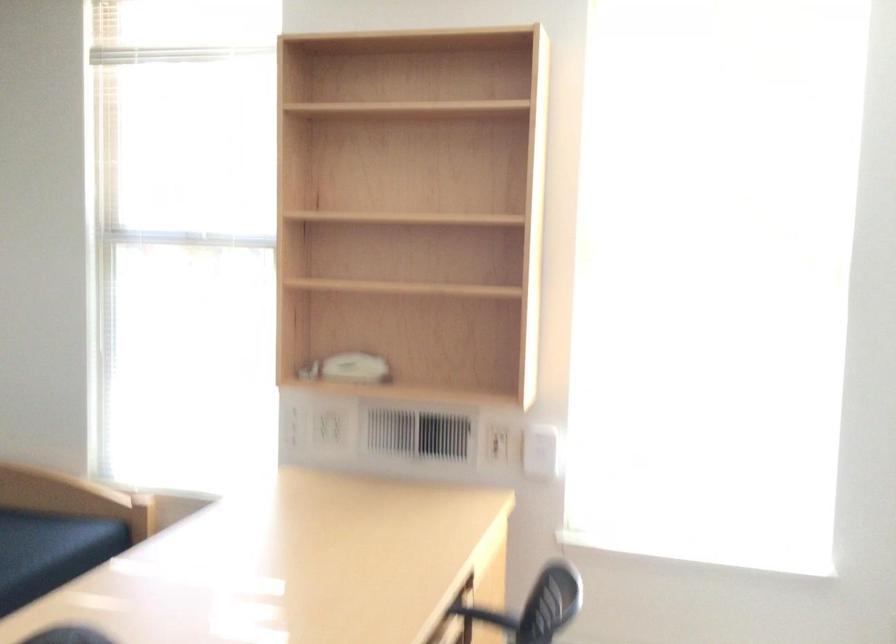
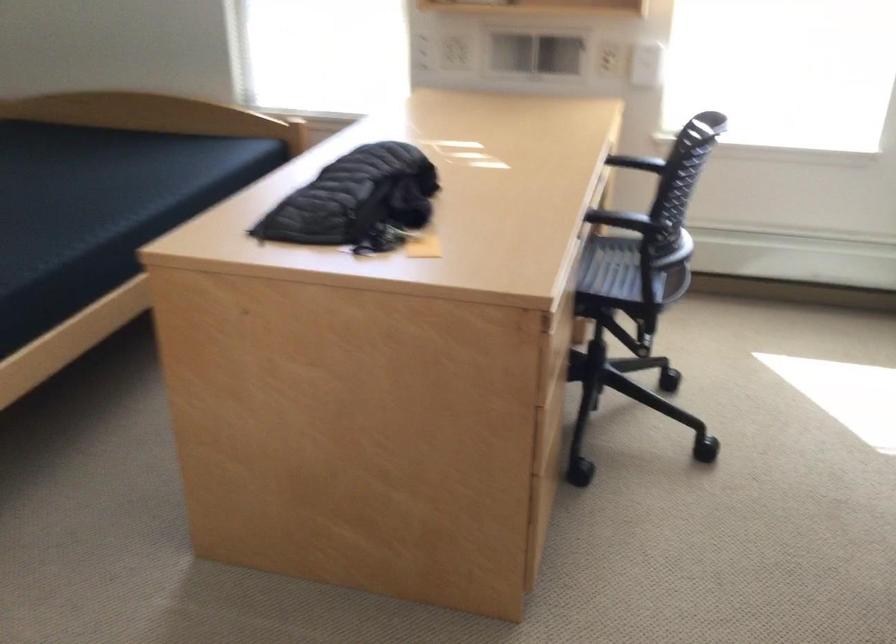
Locate, in the second image, the point that corresponds to point (501, 453) in the first image.

(616, 62)